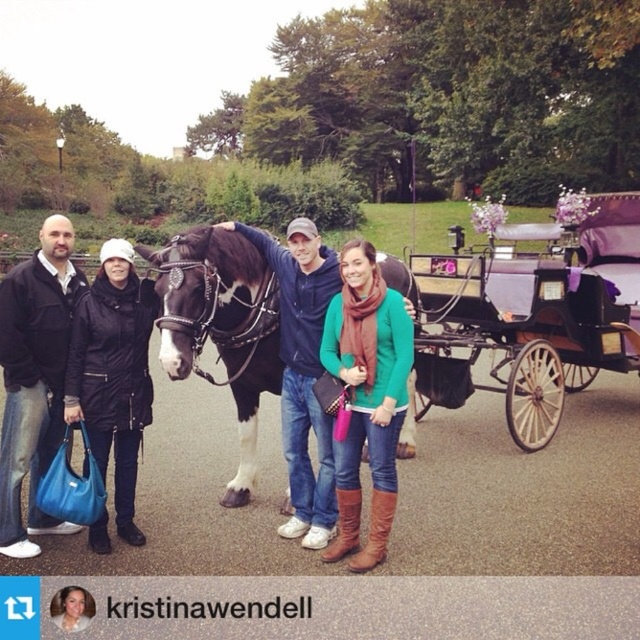
Between point (513, 384) and point (92, 285), which one is positioned behind?

The point (513, 384) is more distant.

Between point (433, 316) and point (147, 381), which one is positioned behind?

The point (433, 316) is more distant.

Identify the location of purple satin horse cart at right. Image resolution: width=640 pixels, height=640 pixels. coord(540,304).

Which is behind, point (570, 340) or point (61, 230)?

The point (570, 340) is behind.

Measure the distance between purple satin horse cart at right and matte black jacket at left.

A distance of 3.87 meters exists between purple satin horse cart at right and matte black jacket at left.

Is point (605, 212) in front of point (17, 316)?

No, (605, 212) is behind (17, 316).

Locate an element on the screen. purple satin horse cart at right is located at coordinates (540, 304).

Is purple satin horse cart at right to the left of green matte sweater at center from the viewer's perspective?

In fact, purple satin horse cart at right is to the right of green matte sweater at center.

Can you confirm if purple satin horse cart at right is positioned above green matte sweater at center?

Yes, purple satin horse cart at right is above green matte sweater at center.

Which is in front, point (467, 320) or point (396, 412)?

Point (396, 412) is more forward.

The image size is (640, 640). Find the location of `purple satin horse cart at right`. purple satin horse cart at right is located at coordinates (540, 304).